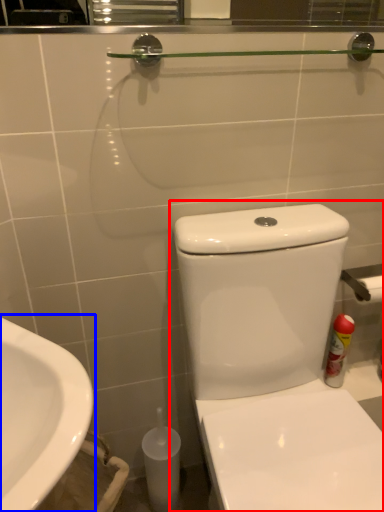
Question: Which of the following is the farthest to the observer, toilet (highlighted by a red box) or sink (highlighted by a blue box)?

Choices:
 (A) toilet
 (B) sink

Answer: (B)